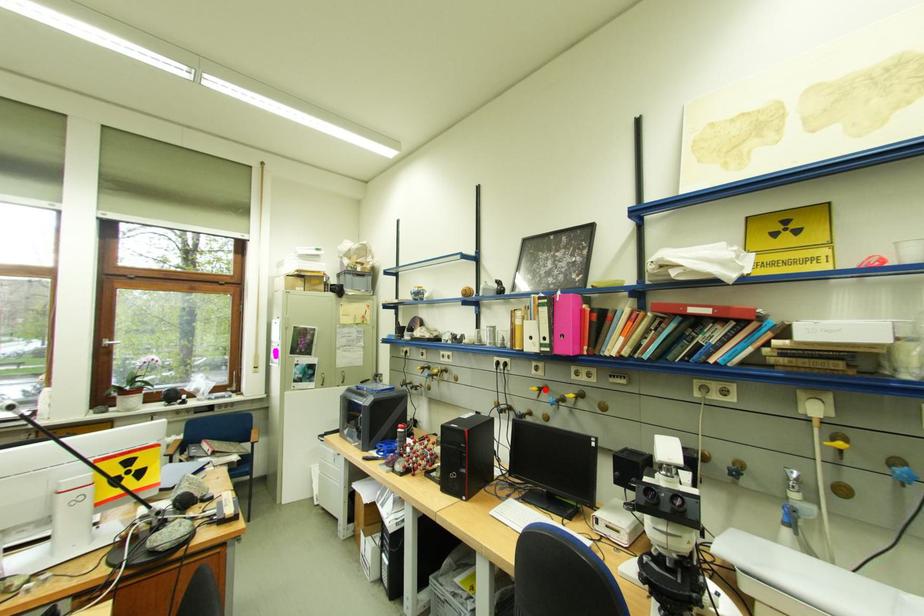
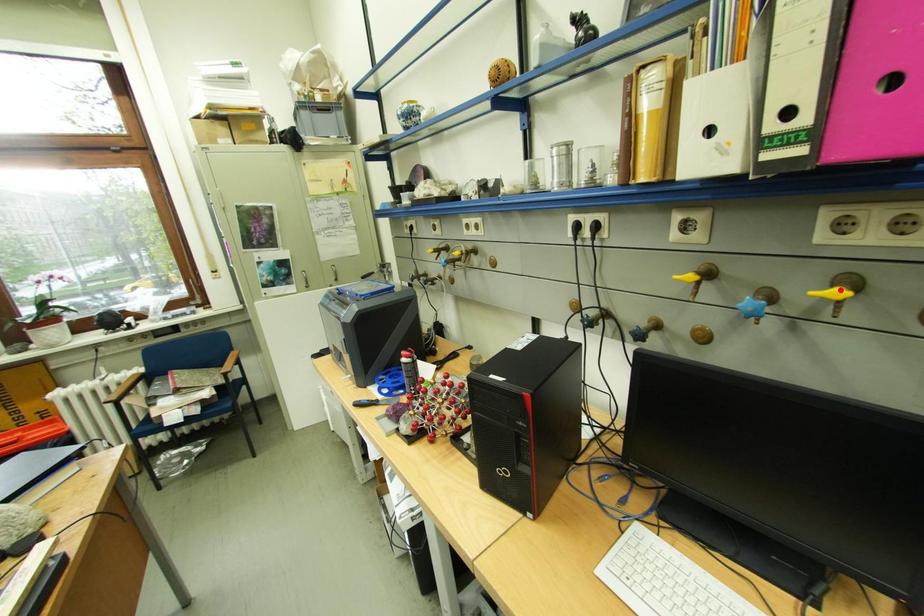
I am providing you with two images of the same scene from different viewpoints. A red point is marked on the first image and another point is marked on the second image. Is the red point in image1 aligned with the point shown in image2?

No